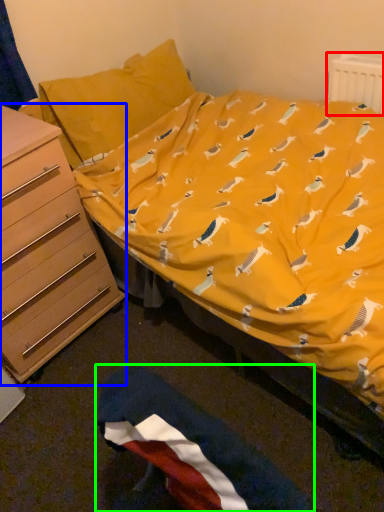
Question: Considering the real-world distances, which object is farthest from radiator (highlighted by a red box)? chest of drawers (highlighted by a blue box) or flag (highlighted by a green box)?

Choices:
 (A) chest of drawers
 (B) flag

Answer: (B)